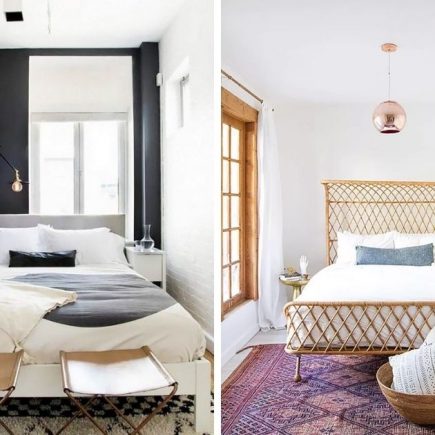
Image resolution: width=435 pixels, height=435 pixels. I want to click on glass vase, so click(147, 239).